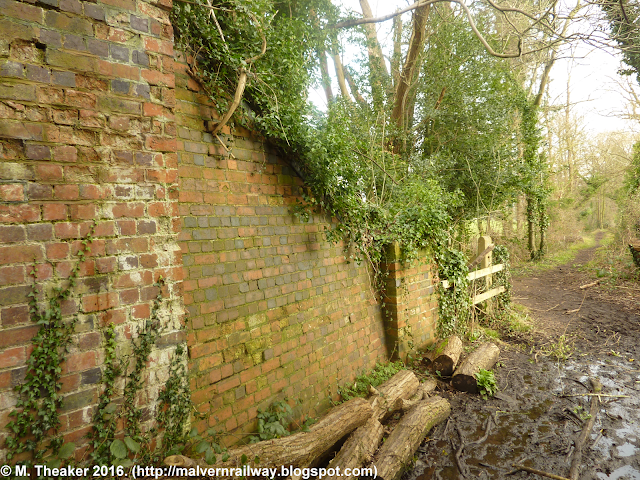
Image resolution: width=640 pixels, height=480 pixels. I want to click on brick wall, so click(186, 271).